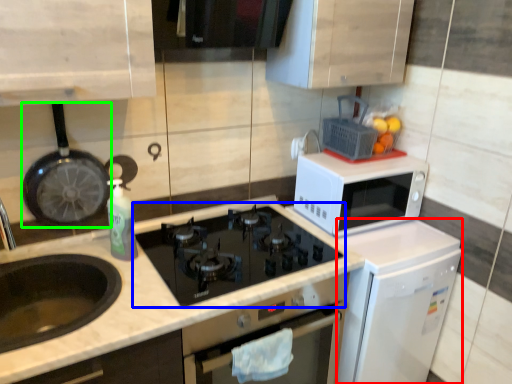
Question: Estimate the real-world distances between objects in this image. Which object is closer to dish washer (highlighted by a red box), gas stove (highlighted by a blue box) or frying pan (highlighted by a green box)?

Choices:
 (A) gas stove
 (B) frying pan

Answer: (A)